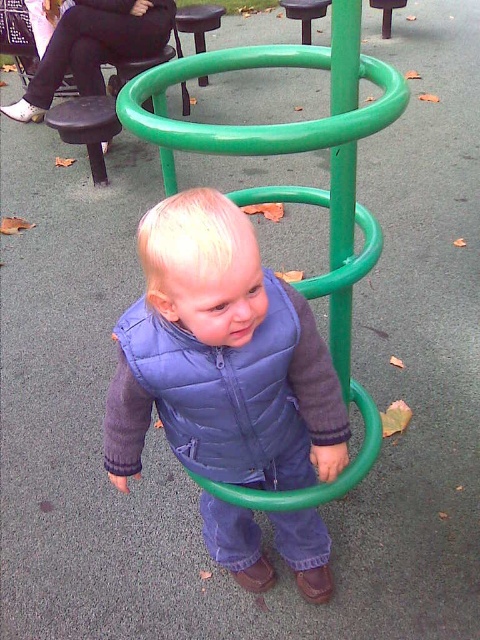
Question: Which point appears closest to the camera in this image?

Choices:
 (A) (199, 49)
 (B) (59, 125)
 (C) (300, 483)
 (D) (244, 67)

Answer: (D)

Question: Is blue quilted vest at center below black plastic stool at upper center?

Choices:
 (A) yes
 (B) no

Answer: (A)

Question: Which is nearer to the black plastic stool at upper left?

Choices:
 (A) green rubber hula hoop at center
 (B) blue quilted vest at center
 (C) black plastic stool at upper center

Answer: (C)

Question: Is green rubber hula hoop at center thinner than black plastic stool at upper left?

Choices:
 (A) no
 (B) yes

Answer: (A)

Question: Observing the image, what is the correct spatial positioning of blue quilted vest at center in reference to black plastic stool at upper center?

Choices:
 (A) below
 (B) above

Answer: (A)

Question: Which of the following is the closest to the observer?

Choices:
 (A) black plastic stool at upper center
 (B) black plastic stool at upper left

Answer: (B)